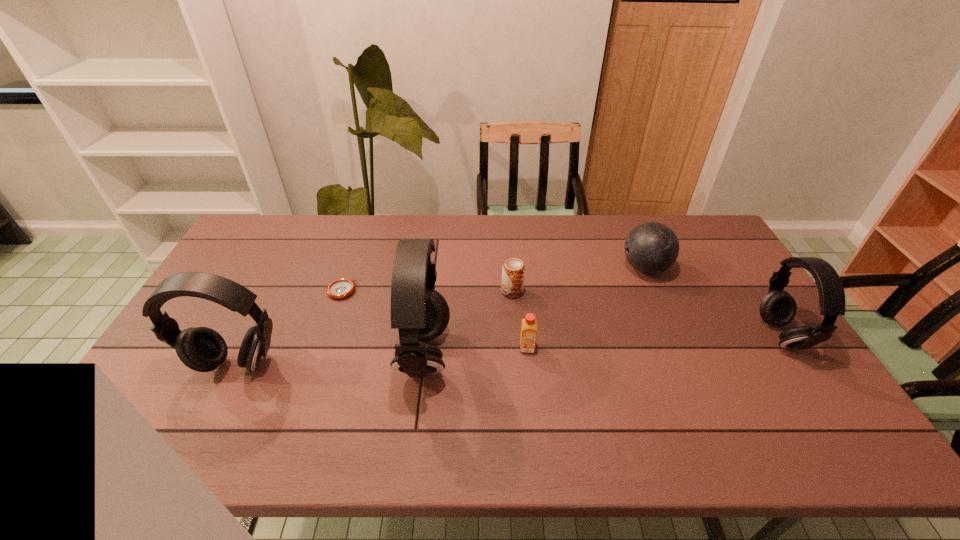
Where is `object that is the second closest to the rightmost earphone`? This screenshot has width=960, height=540. object that is the second closest to the rightmost earphone is located at coordinates (529, 325).

Identify which object is the second nearest to the bowling ball. Please provide its 2D coordinates. Your answer should be formatted as a tuple, i.e. [(x, y)], where the tuple contains the x and y coordinates of a point satisfying the conditions above.

[(513, 271)]

This screenshot has height=540, width=960. Identify the location of earphone that is the closest to the beer can. (420, 313).

Identify the location of earphone that stands as the second closest to the leftmost earphone. The image size is (960, 540). (778, 308).

The width and height of the screenshot is (960, 540). I want to click on free region that satisfies the following two spatial constraints: 1. on the grip area of the fourth shortest object; 2. on the front and back of the orange juice, so click(679, 348).

Where is `free location that satisfies the following two spatial constraints: 1. on the front and back of the orange juice; 2. on the ear cups of the second earphone from right to left`? free location that satisfies the following two spatial constraints: 1. on the front and back of the orange juice; 2. on the ear cups of the second earphone from right to left is located at coordinates (528, 354).

The height and width of the screenshot is (540, 960). Identify the location of vacant space that satisfies the following two spatial constraints: 1. on the grip area of the bowling ball; 2. on the front and back of the orange juice. (679, 348).

I want to click on vacant space that satisfies the following two spatial constraints: 1. on the grip area of the bowling ball; 2. on the front side of the shortest object, so click(655, 291).

Where is `vacant region that satisfies the following two spatial constraints: 1. on the grip area of the bowling ball; 2. on the ear cups of the second tallest object`? vacant region that satisfies the following two spatial constraints: 1. on the grip area of the bowling ball; 2. on the ear cups of the second tallest object is located at coordinates (685, 364).